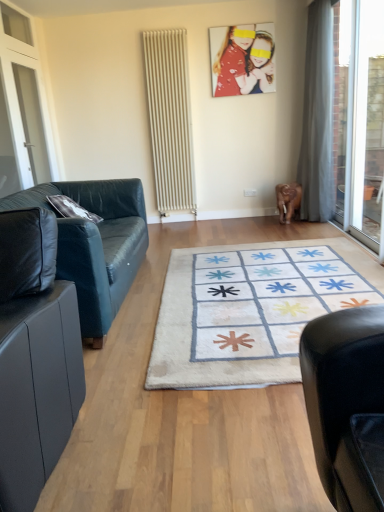
Question: From the image's perspective, is transparent glass door at right located beneath white glass screen door at left?

Choices:
 (A) yes
 (B) no

Answer: (A)

Question: Is transparent glass door at right not close to white glass screen door at left?

Choices:
 (A) yes
 (B) no

Answer: (A)

Question: From a real-world perspective, is transparent glass door at right located higher than white glass screen door at left?

Choices:
 (A) yes
 (B) no

Answer: (B)

Question: Is transparent glass door at right positioned with its back to white glass screen door at left?

Choices:
 (A) no
 (B) yes

Answer: (A)

Question: Considering the relative positions of transparent glass door at right and white glass screen door at left in the image provided, is transparent glass door at right to the left of white glass screen door at left from the viewer's perspective?

Choices:
 (A) no
 (B) yes

Answer: (A)

Question: Does transparent glass door at right have a smaller size compared to white glass screen door at left?

Choices:
 (A) no
 (B) yes

Answer: (A)

Question: Is beige textured radiator at center not close to black leather couch at left, which ranks as the 2th studio couch in front-to-back order?

Choices:
 (A) no
 (B) yes

Answer: (B)

Question: Is beige textured radiator at center bigger than black leather couch at left, positioned as the 1th studio couch in back-to-front order?

Choices:
 (A) yes
 (B) no

Answer: (B)

Question: Is black leather couch at left, which ranks as the 2th studio couch in front-to-back order, a part of beige textured radiator at center?

Choices:
 (A) no
 (B) yes

Answer: (A)

Question: Is beige textured radiator at center taller than black leather couch at left, which ranks as the 2th studio couch in front-to-back order?

Choices:
 (A) yes
 (B) no

Answer: (A)

Question: Is the depth of beige textured radiator at center less than that of black leather couch at left, which ranks as the 2th studio couch in front-to-back order?

Choices:
 (A) no
 (B) yes

Answer: (A)

Question: Does beige textured radiator at center appear on the right side of black leather couch at left, positioned as the 1th studio couch in back-to-front order?

Choices:
 (A) yes
 (B) no

Answer: (A)

Question: Is gray fabric curtain at right to the left of white glass screen door at left from the viewer's perspective?

Choices:
 (A) no
 (B) yes

Answer: (A)